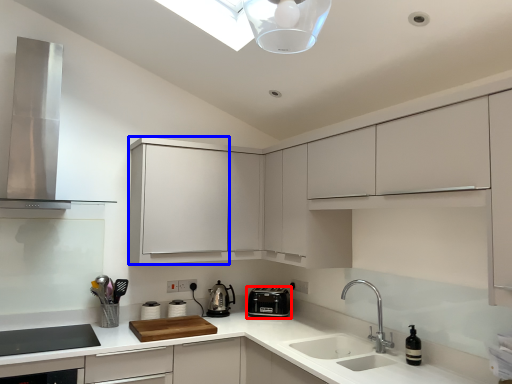
Question: Which object is closer to the camera taking this photo, kitchen appliance (highlighted by a red box) or cabinetry (highlighted by a blue box)?

Choices:
 (A) kitchen appliance
 (B) cabinetry

Answer: (B)